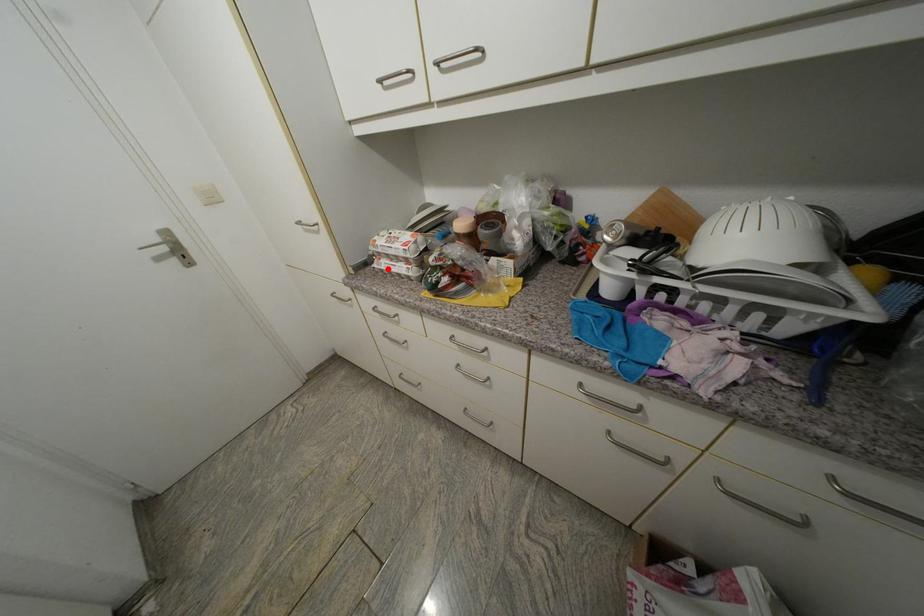
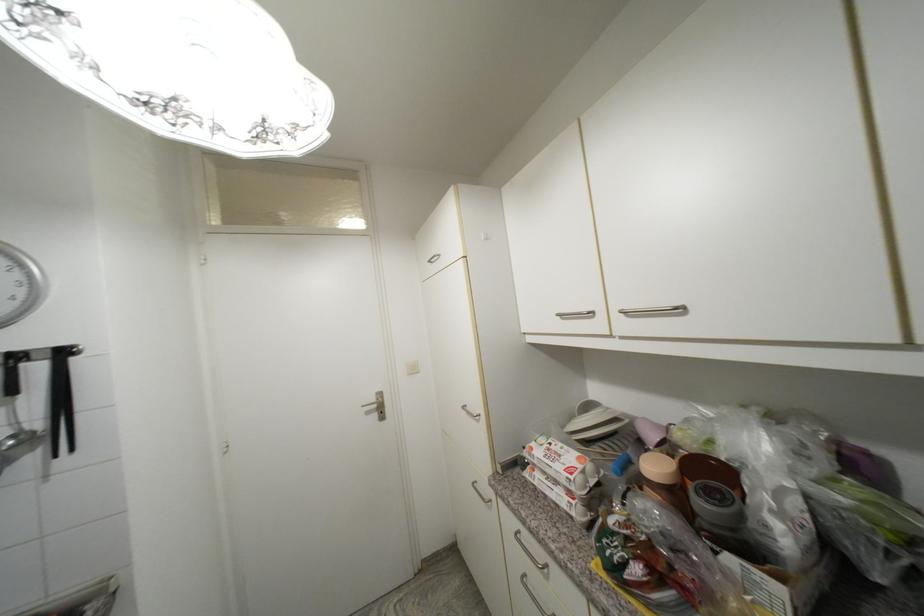
The point at the highlighted location is marked in the first image. Where is the corresponding point in the second image?

(541, 485)